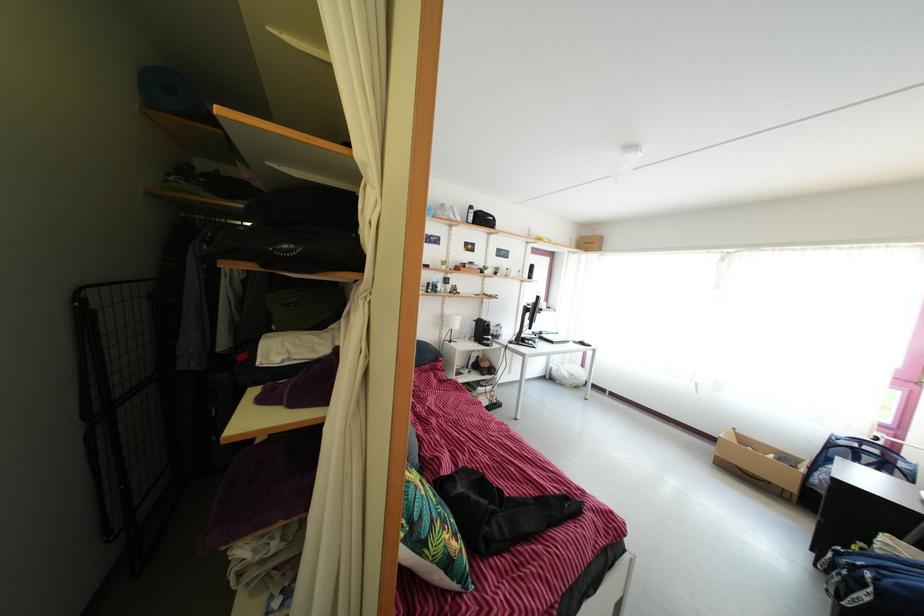
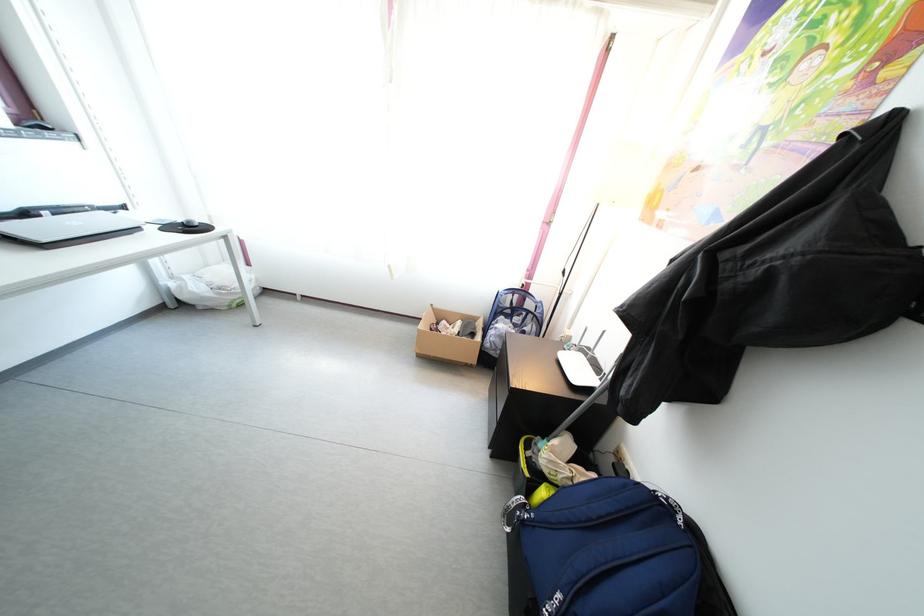
In the second image, find the point that corresponds to the point at 570,386 in the first image.

(210, 306)